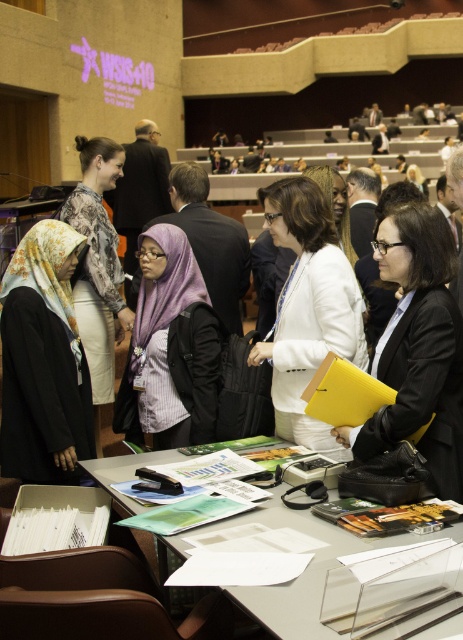
From the picture: Is purple fabric hijab at center closer to the viewer compared to translucent plastic table at center?

No, purple fabric hijab at center is further to the viewer.

Which is in front, point (180, 289) or point (113, 474)?

Positioned in front is point (113, 474).

This screenshot has width=463, height=640. What do you see at coordinates (169, 348) in the screenshot?
I see `purple fabric hijab at center` at bounding box center [169, 348].

Find the location of a particular element. purple fabric hijab at center is located at coordinates (169, 348).

Who is positioned more to the right, black leather jacket at center or floral-patterned fabric hijab at left?

black leather jacket at center

Measure the distance between black leather jacket at center and camera.

The distance of black leather jacket at center from camera is 1.90 meters.

Find the location of a particular element. The width and height of the screenshot is (463, 640). black leather jacket at center is located at coordinates (418, 348).

Is translucent plastic table at center thinner than printed silk blouse at upper left?

No.

Which is in front, point (225, 593) or point (75, 314)?

Positioned in front is point (225, 593).

This screenshot has height=640, width=463. I want to click on translucent plastic table at center, so click(300, 577).